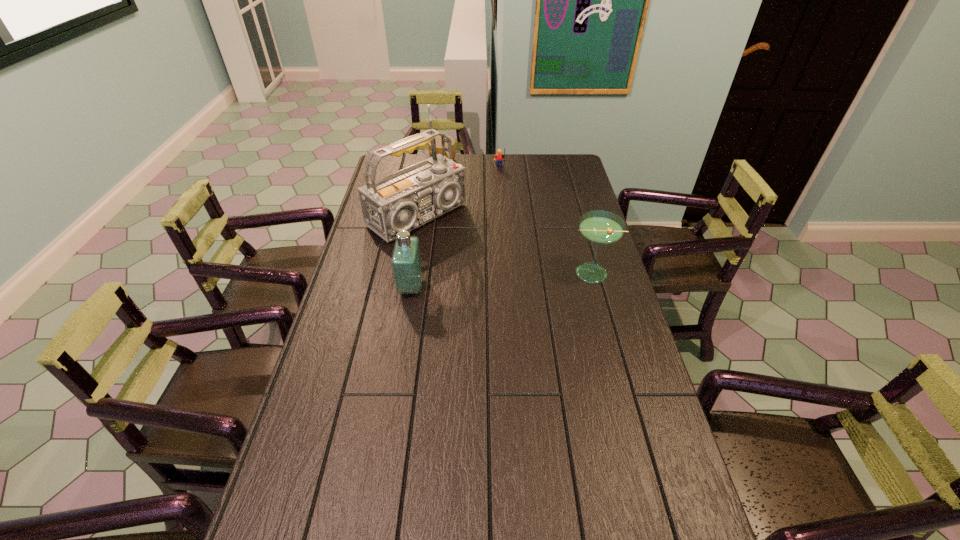
Identify the location of vacant spot on the desktop that is between the perfume and the martini and is positioned on the front-facing side of the radio receiver. The height and width of the screenshot is (540, 960). (510, 279).

What are the coordinates of `free space on the desktop that is between the perfume and the rightmost object and is positioned on the front-facing side of the Lego` in the screenshot? It's located at (508, 280).

Where is `free spot on the desktop that is between the perfume and the martini and is positioned on the side with the handle of the mug`? This screenshot has width=960, height=540. free spot on the desktop that is between the perfume and the martini and is positioned on the side with the handle of the mug is located at coordinates (478, 282).